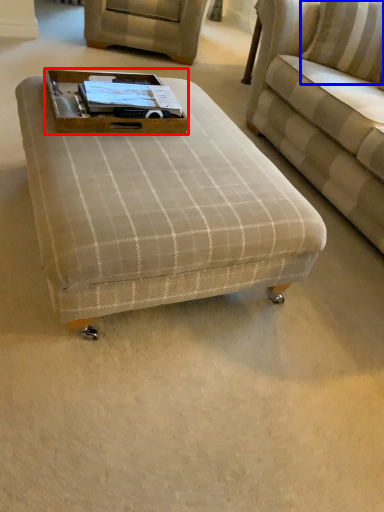
Question: Which point is closer to the camera, side table (highlighted by a red box) or pillow (highlighted by a blue box)?

Choices:
 (A) side table
 (B) pillow

Answer: (A)